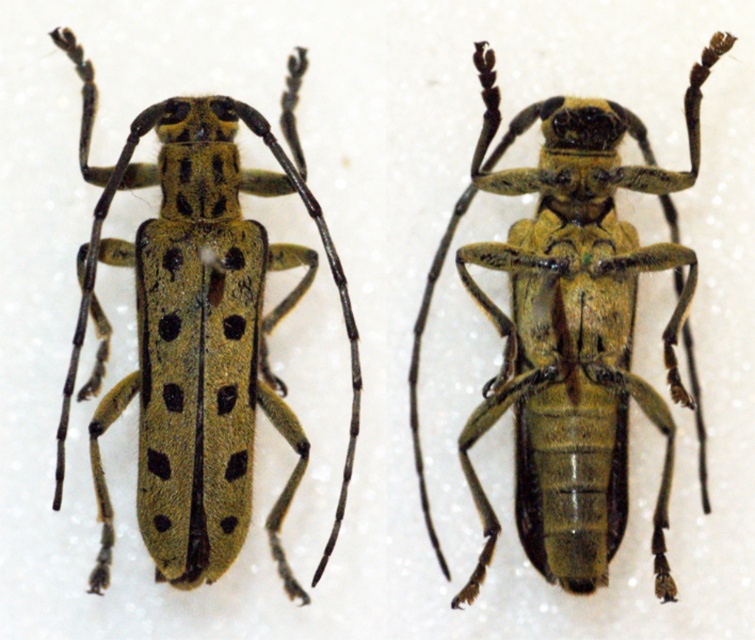
Question: Which point appears farthest from the camera in this image?

Choices:
 (A) (525, 172)
 (B) (168, 112)

Answer: (A)

Question: Does green matte beetle at center appear under green textured beetle at center?

Choices:
 (A) no
 (B) yes

Answer: (B)

Question: Does green matte beetle at center have a larger size compared to green textured beetle at center?

Choices:
 (A) no
 (B) yes

Answer: (A)

Question: Which object appears closest to the camera in this image?

Choices:
 (A) green textured beetle at center
 (B) green matte beetle at center

Answer: (A)

Question: Does green matte beetle at center appear over green textured beetle at center?

Choices:
 (A) no
 (B) yes

Answer: (A)